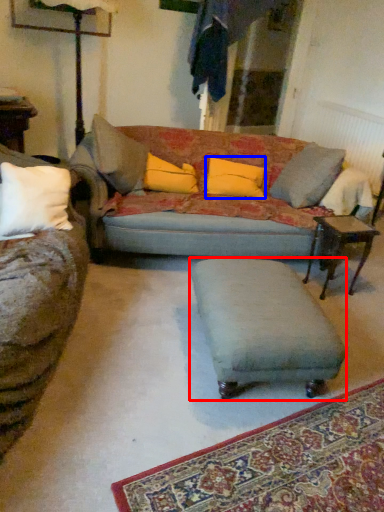
Question: Among these objects, which one is farthest to the camera, footrest (highlighted by a red box) or pillow (highlighted by a blue box)?

Choices:
 (A) footrest
 (B) pillow

Answer: (B)